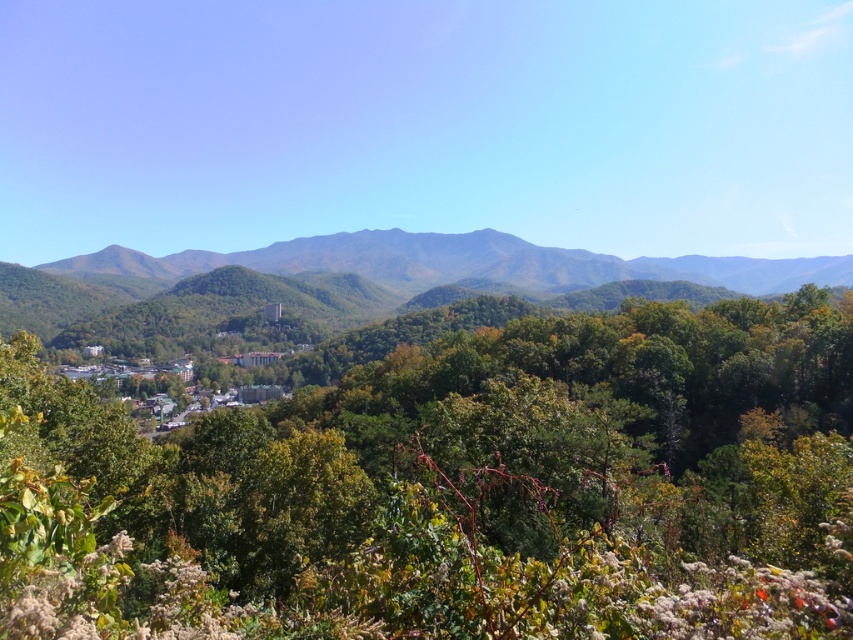
Based on the photo, is green leafy tree at center shorter than green leafy forest at center?

Yes, green leafy tree at center is shorter than green leafy forest at center.

Who is taller, green leafy tree at center or green leafy forest at center?

green leafy forest at center

Is point (350, 554) in front of point (68, 285)?

Yes, it is.

This screenshot has width=853, height=640. What are the coordinates of `green leafy tree at center` in the screenshot? It's located at (456, 490).